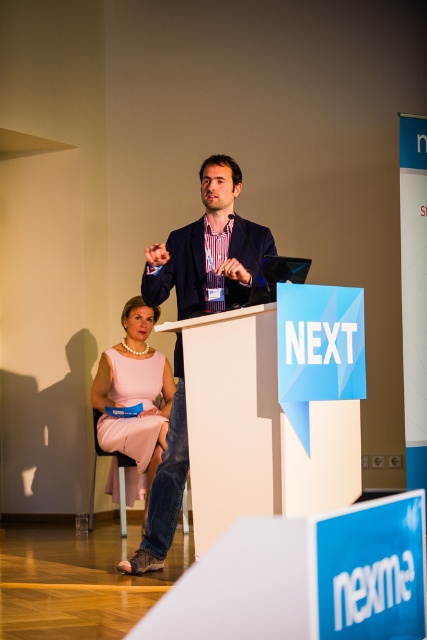
Is dark blue suit at center smaller than pink satin dress at lower left?

Actually, dark blue suit at center might be larger than pink satin dress at lower left.

Between dark blue suit at center and pink satin dress at lower left, which one appears on the right side from the viewer's perspective?

Positioned to the right is dark blue suit at center.

In order to click on dark blue suit at center in this screenshot , I will do `click(208, 250)`.